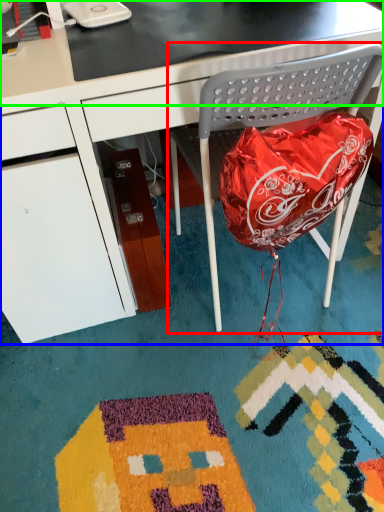
Question: Which is nearer to the folding chair (highlighted by a red box)? desk (highlighted by a blue box) or table top (highlighted by a green box).

Choices:
 (A) desk
 (B) table top

Answer: (B)